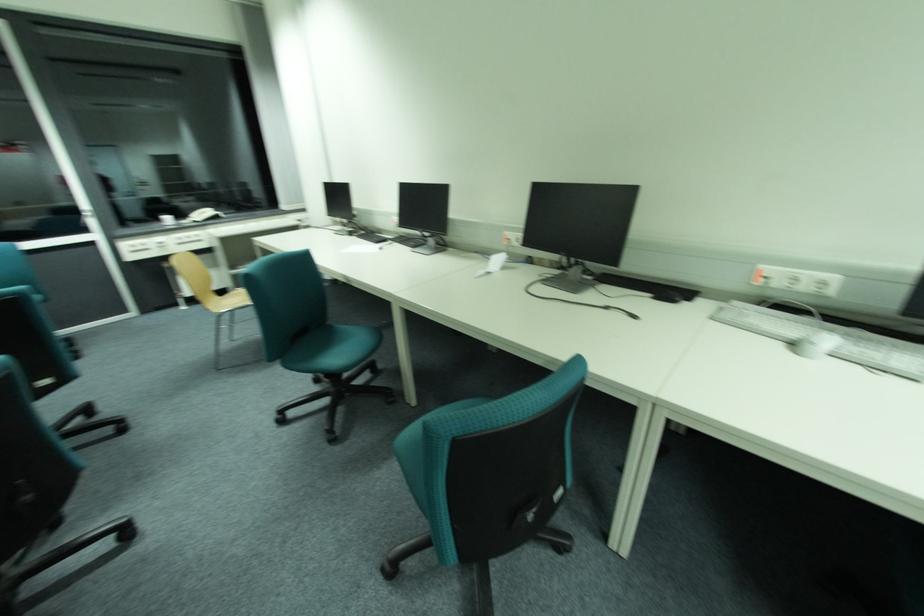
Locate an element on the screen. This screenshot has width=924, height=616. black keyboard is located at coordinates (878, 367).